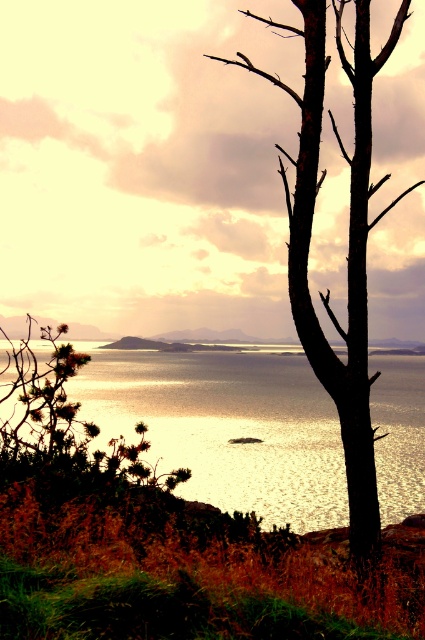
Measure the distance from glistening reflective water at center to black bark tree at right.

They are 5.10 meters apart.

Between point (207, 492) and point (241, 65), which one is positioned in front?

Positioned in front is point (241, 65).

The image size is (425, 640). Identify the location of glistening reflective water at center. (226, 428).